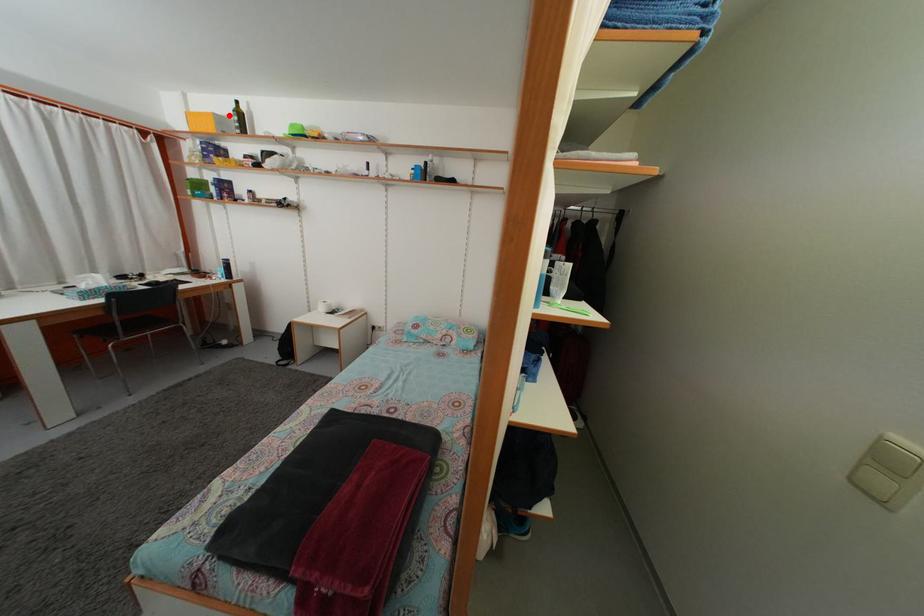
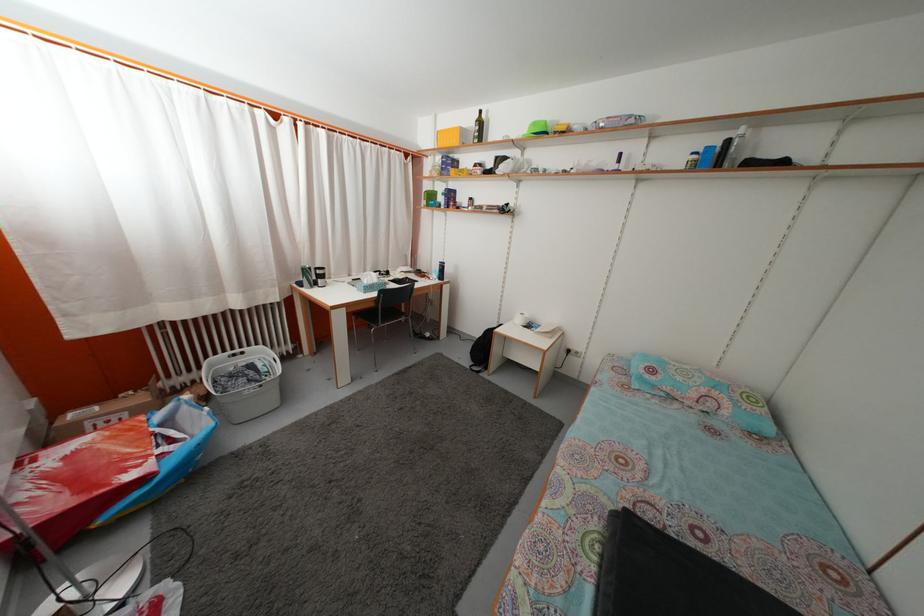
Question: I am providing you with two images of the same scene from different viewpoints. Given a red point in image1, look at the same physical point in image2. Is it:

Choices:
 (A) Closer to the viewpoint
 (B) Farther from the viewpoint

Answer: (A)